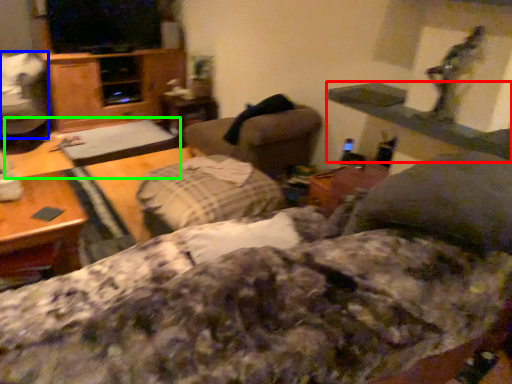
Question: Which is nearer to the table (highlighted by a red box)? swivel chair (highlighted by a blue box) or table (highlighted by a green box).

Choices:
 (A) swivel chair
 (B) table

Answer: (B)